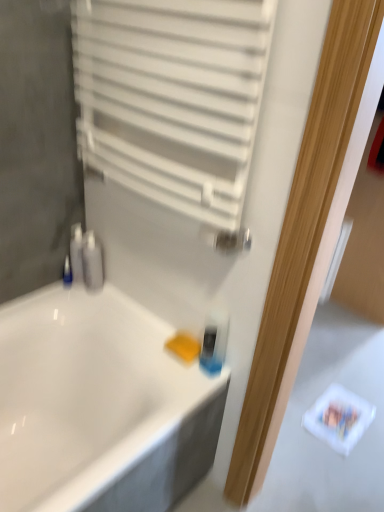
Identify the location of free spot in front of satin silver soap dispenser at left, positioned as the 2th toiletry in left-to-right order. (101, 307).